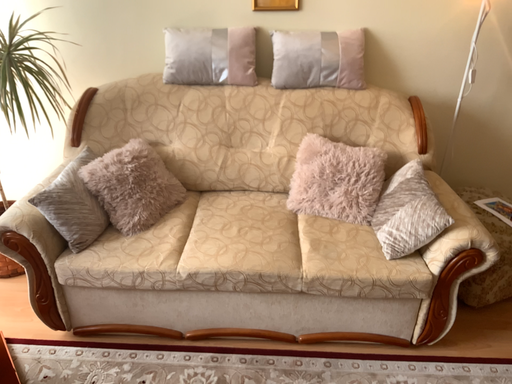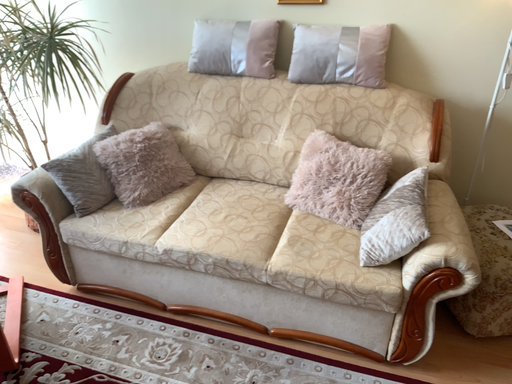
Question: Which way did the camera rotate in the video?

Choices:
 (A) rotated right
 (B) rotated left

Answer: (B)